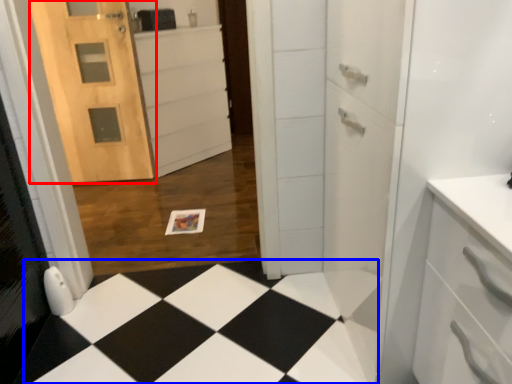
Question: Among these objects, which one is nearest to the camera, door (highlighted by a red box) or square (highlighted by a blue box)?

Choices:
 (A) door
 (B) square

Answer: (B)